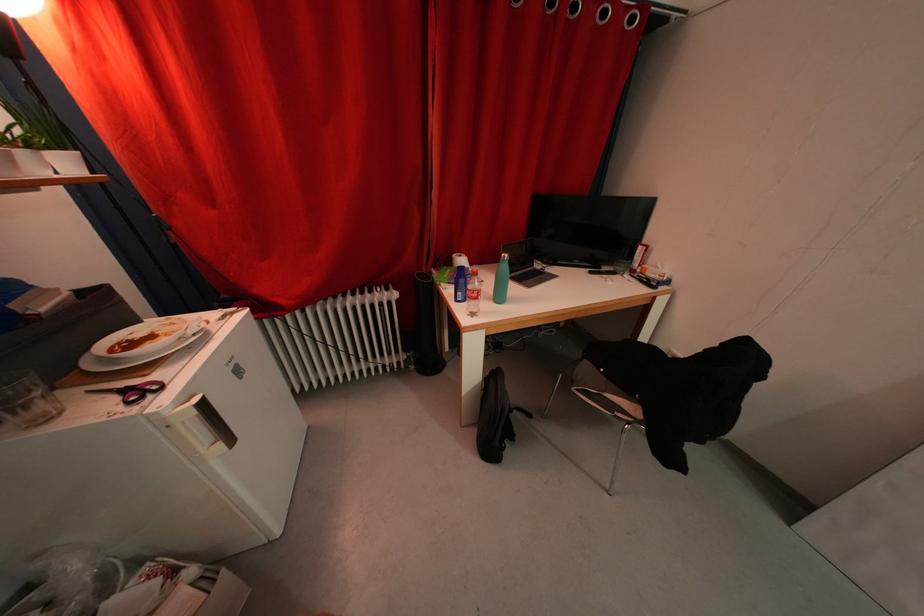
Identify the location of plastic coke bottle. The image size is (924, 616). (472, 293).